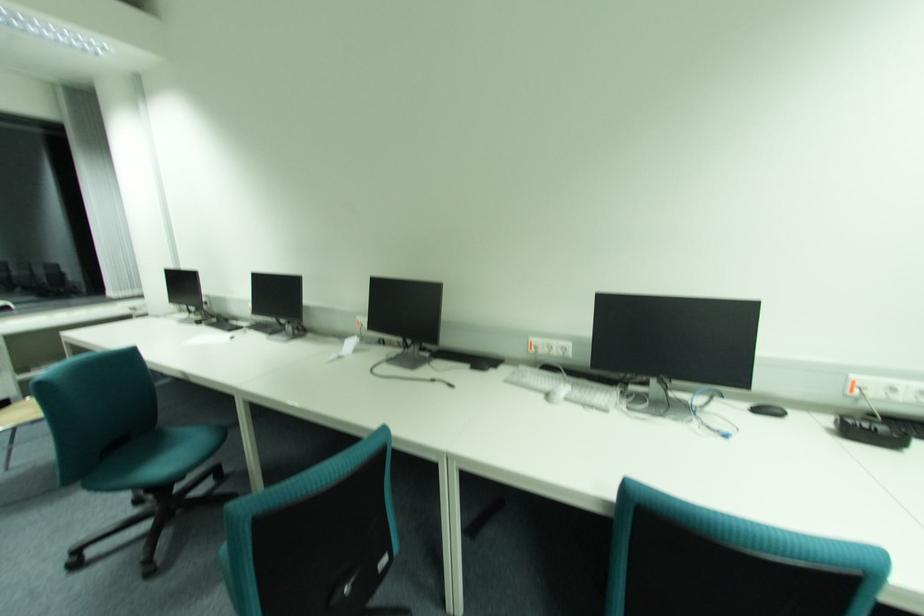
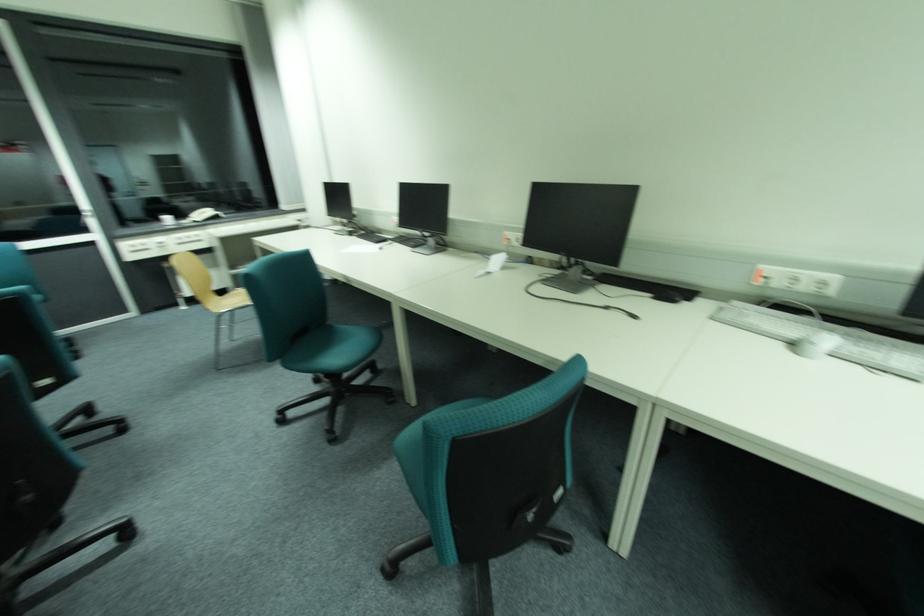
The point at (553, 395) is marked in the first image. Where is the corresponding point in the second image?

(800, 345)